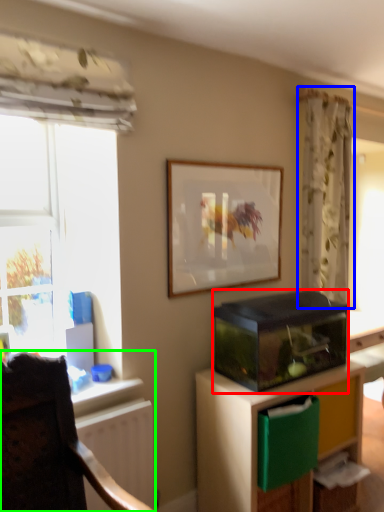
Question: Which object is the farthest from appliance (highlighted by a red box)? Choose among these: curtain (highlighted by a blue box) or chair (highlighted by a green box).

Choices:
 (A) curtain
 (B) chair

Answer: (B)